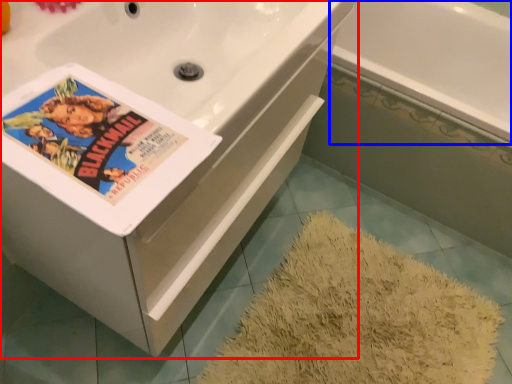
Question: Which object appears closest to the camera in this image, bathtub (highlighted by a red box) or bath (highlighted by a blue box)?

Choices:
 (A) bathtub
 (B) bath

Answer: (A)